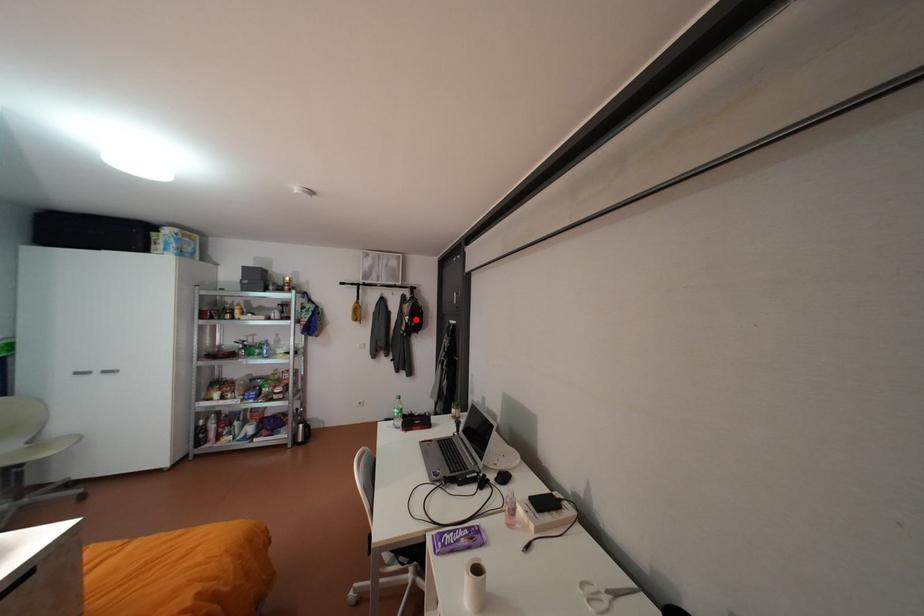
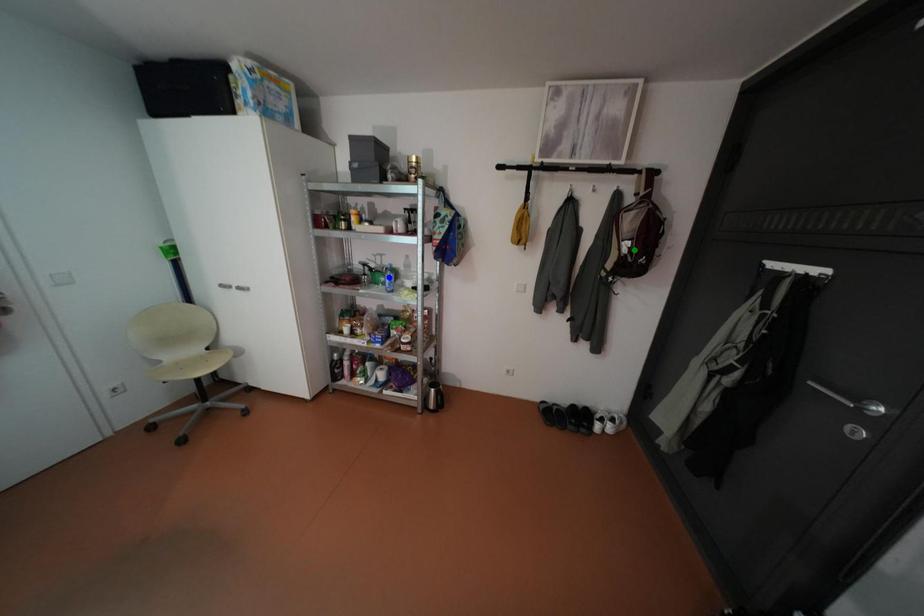
Question: I am providing you with two images of the same scene from different viewpoints. A red point is marked on the first image. You are given multiple points on the second image. In image 2, which mark is for the same physical point as the one in image 1?

Choices:
 (A) yellow point
 (B) green point
 (C) blue point

Answer: (B)